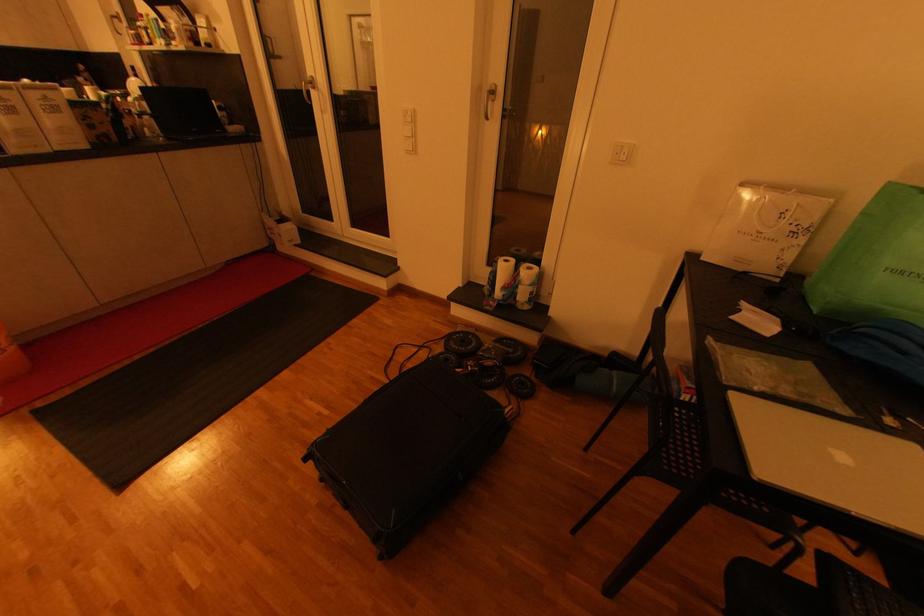
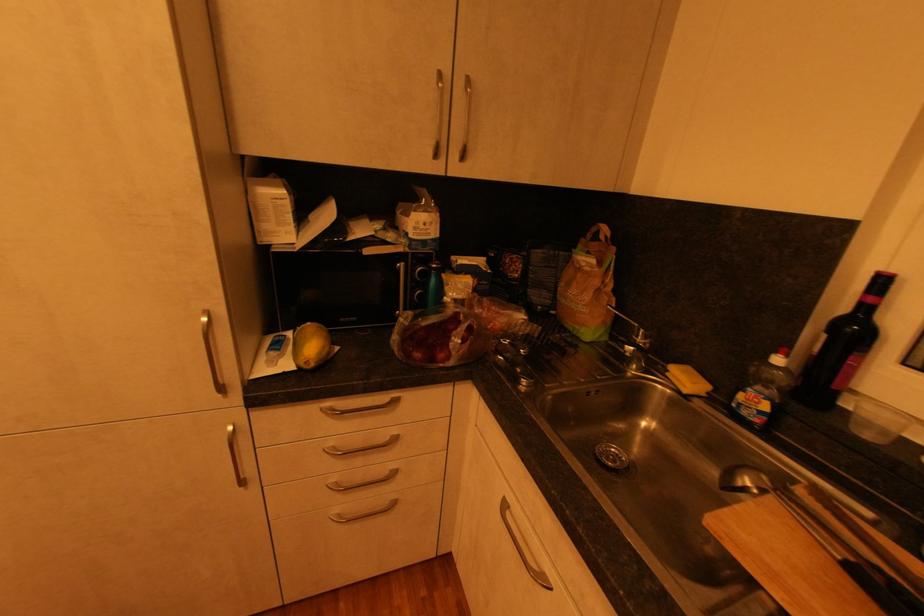
Where in the second image is the point corresponding to the point at 91,81 from the first image?

(604, 264)